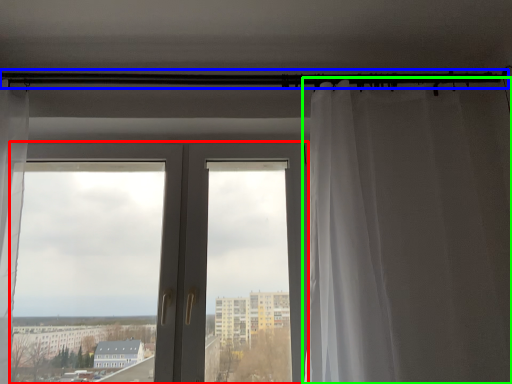
Question: Which object is positioned closest to door (highlighted by a red box)? Select from beam (highlighted by a blue box) and curtain (highlighted by a green box).

Choices:
 (A) beam
 (B) curtain

Answer: (B)